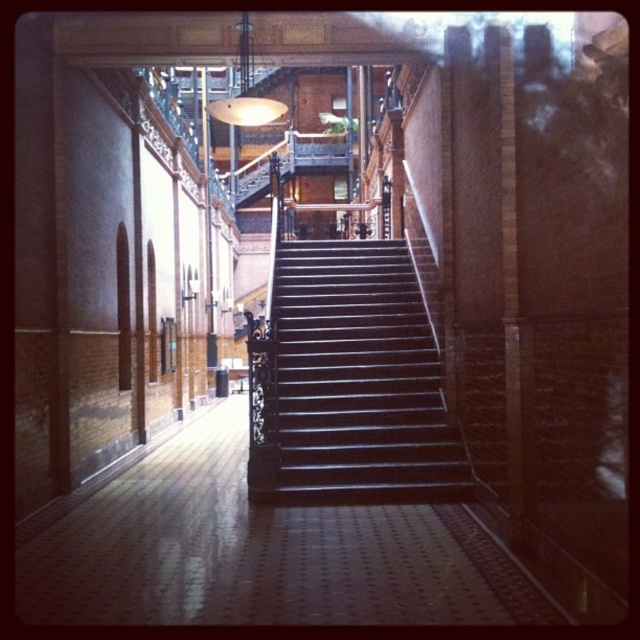
Question: Is brown polished wood floor at center bigger than shiny dark wood stairs at center?

Choices:
 (A) no
 (B) yes

Answer: (A)

Question: Observing the image, what is the correct spatial positioning of brown polished wood floor at center in reference to shiny dark wood stairs at center?

Choices:
 (A) right
 (B) left

Answer: (B)

Question: Does brown polished wood floor at center have a larger size compared to shiny dark wood stairs at center?

Choices:
 (A) yes
 (B) no

Answer: (B)

Question: Which object appears farthest from the camera in this image?

Choices:
 (A) shiny dark wood stairs at center
 (B) brown polished wood floor at center

Answer: (A)